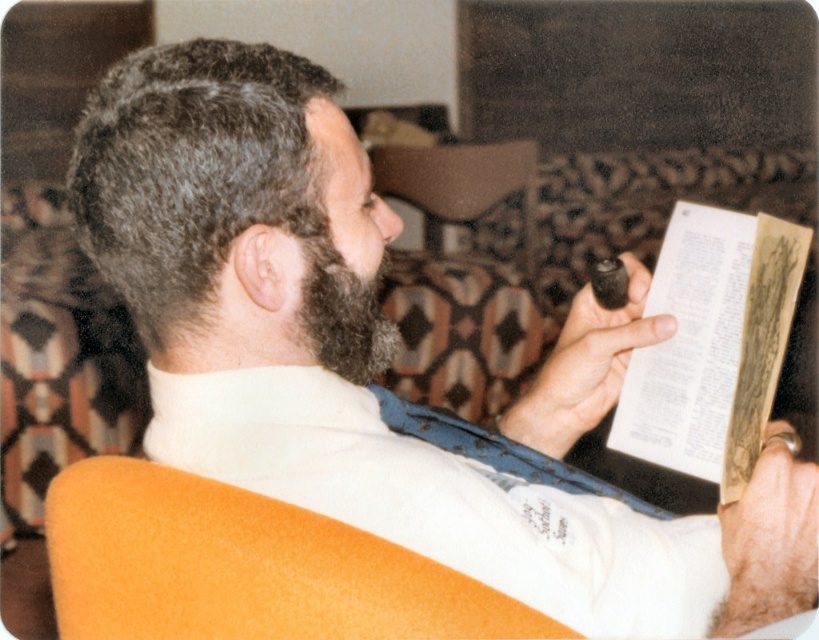
Does yellowed paper book at right appear on the right side of dark brown fuzzy beard at center?

Yes, yellowed paper book at right is to the right of dark brown fuzzy beard at center.

Who is higher up, yellowed paper book at right or dark brown fuzzy beard at center?

Positioned higher is dark brown fuzzy beard at center.

Does point (695, 369) come in front of point (317, 221)?

No, (695, 369) is further to viewer.

Where is `yellowed paper book at right`? The height and width of the screenshot is (640, 819). yellowed paper book at right is located at coordinates (713, 346).

Is orange fabric armchair at lower left positioned before dark brown fuzzy beard at center?

Result: Yes, it is.

Who is more forward, [188,515] or [314,298]?

Positioned in front is point [188,515].

Locate an element on the screen. This screenshot has width=819, height=640. orange fabric armchair at lower left is located at coordinates (245, 568).

Is orange fabric armchair at lower left thinner than yellowed paper book at right?

No.

Which is behind, point (406, 605) or point (631, 374)?

Positioned behind is point (631, 374).

Which is in front, point (170, 634) or point (681, 378)?

Point (170, 634) is more forward.

Identify the location of orange fabric armchair at lower left. (245, 568).